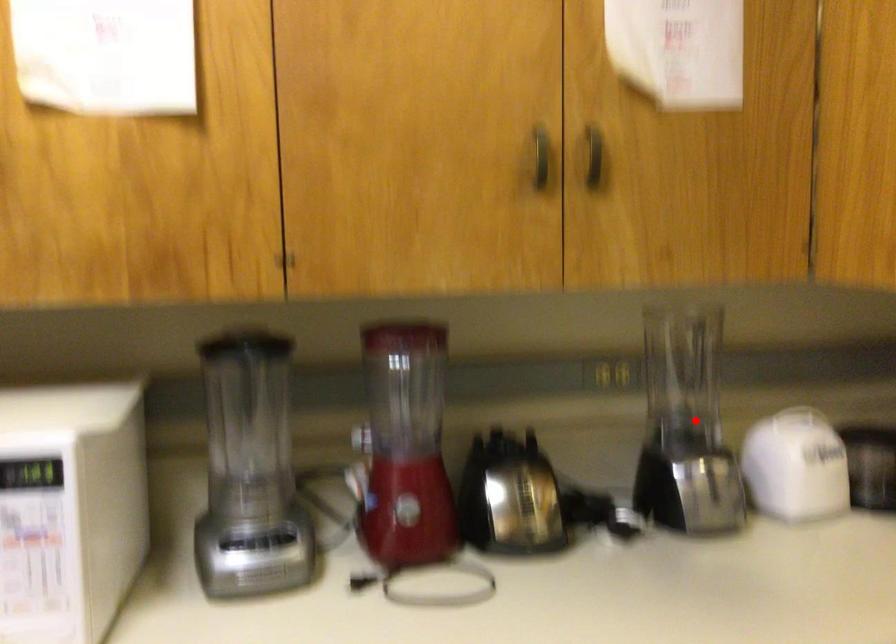
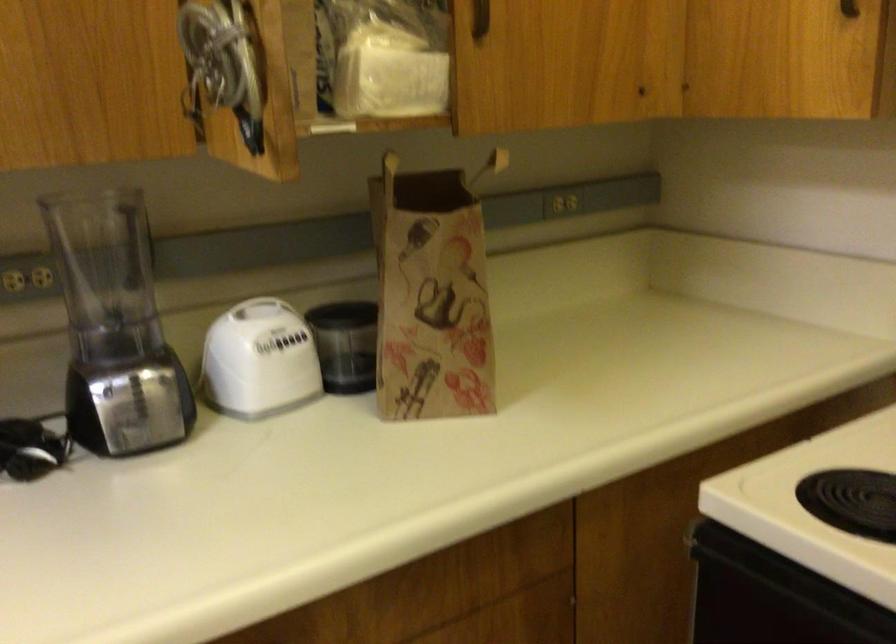
Locate, in the second image, the point that corresponds to the highlighted location in the first image.

(115, 327)